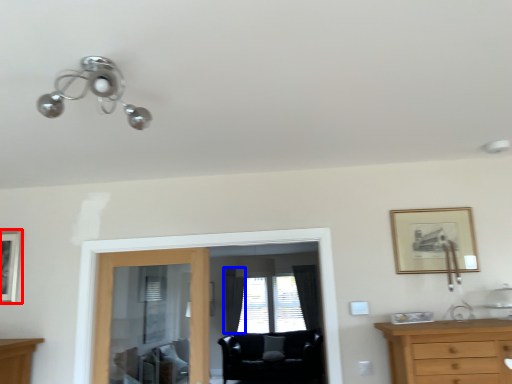
Question: Which object is closer to the camera taking this photo, picture frame (highlighted by a red box) or curtain (highlighted by a blue box)?

Choices:
 (A) picture frame
 (B) curtain

Answer: (A)